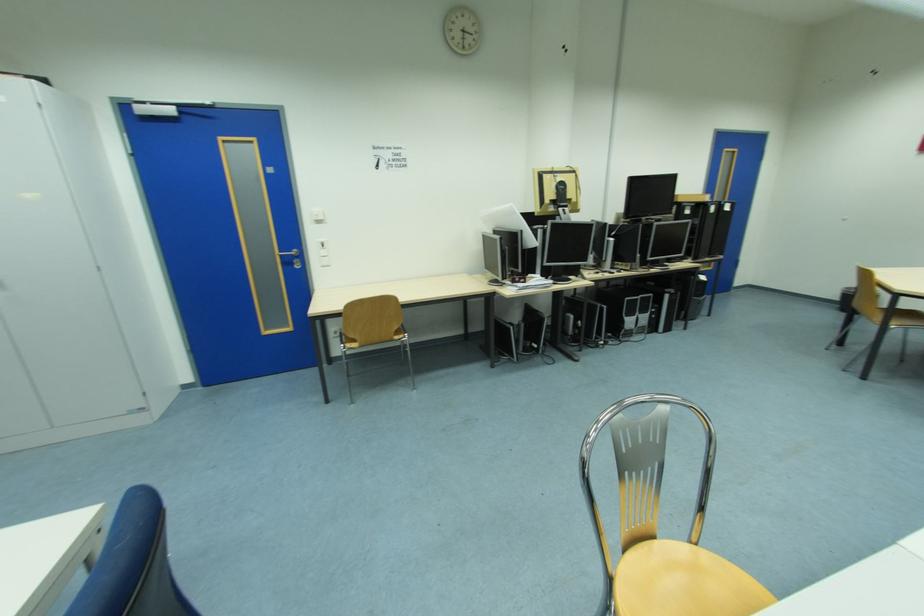
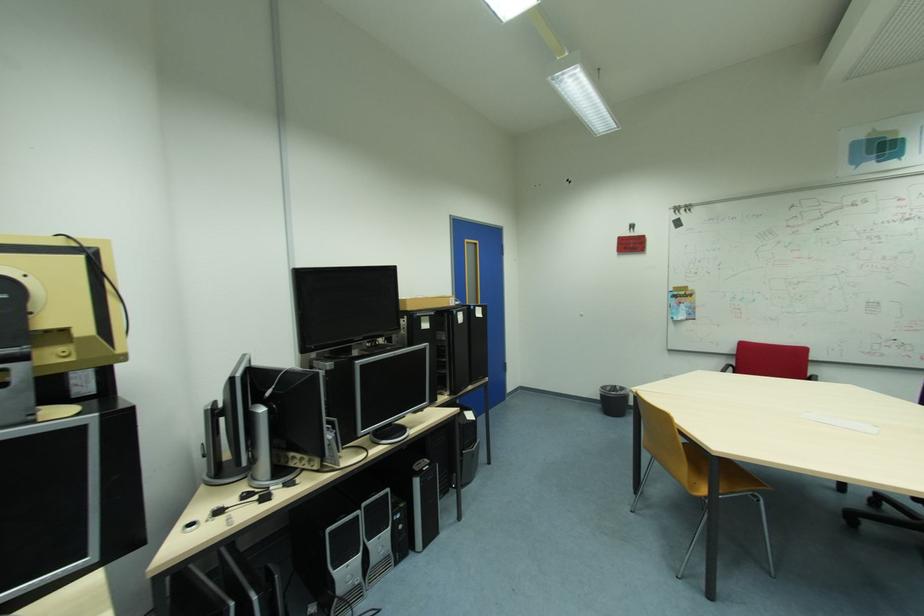
Find the pixel in the second image that matches (646,300) in the first image.

(365, 517)